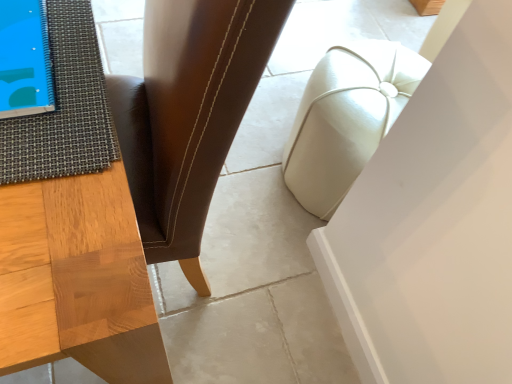
Question: Is brown leather chair at center facing away from textured gray mat at left?

Choices:
 (A) yes
 (B) no

Answer: (A)

Question: Is brown leather chair at center touching textured gray mat at left?

Choices:
 (A) no
 (B) yes

Answer: (A)

Question: Does brown leather chair at center lie in front of textured gray mat at left?

Choices:
 (A) no
 (B) yes

Answer: (B)

Question: From a real-world perspective, is brown leather chair at center positioned under textured gray mat at left based on gravity?

Choices:
 (A) yes
 (B) no

Answer: (A)

Question: Does brown leather chair at center have a lesser height compared to textured gray mat at left?

Choices:
 (A) yes
 (B) no

Answer: (B)

Question: Considering the positions of textured gray mat at left and brown leather chair at center in the image, is textured gray mat at left taller or shorter than brown leather chair at center?

Choices:
 (A) tall
 (B) short

Answer: (B)

Question: In terms of width, does textured gray mat at left look wider or thinner when compared to brown leather chair at center?

Choices:
 (A) wide
 (B) thin

Answer: (B)

Question: Based on their sizes in the image, would you say textured gray mat at left is bigger or smaller than brown leather chair at center?

Choices:
 (A) small
 (B) big

Answer: (A)

Question: From a real-world perspective, is textured gray mat at left positioned above or below brown leather chair at center?

Choices:
 (A) above
 (B) below

Answer: (A)

Question: Considering the positions of point (318, 89) and point (31, 175), is point (318, 89) closer or farther from the camera than point (31, 175)?

Choices:
 (A) farther
 (B) closer

Answer: (A)

Question: From a real-world perspective, is white leather ottoman at center above or below textured gray mat at left?

Choices:
 (A) below
 (B) above

Answer: (A)

Question: From the image's perspective, relative to textured gray mat at left, is white leather ottoman at center above or below?

Choices:
 (A) above
 (B) below

Answer: (B)

Question: Looking at their shapes, would you say white leather ottoman at center is wider or thinner than textured gray mat at left?

Choices:
 (A) wide
 (B) thin

Answer: (B)

Question: Is textured gray mat at left inside the boundaries of white leather ottoman at center, or outside?

Choices:
 (A) inside
 (B) outside

Answer: (B)

Question: Is point (56, 74) closer or farther from the camera than point (305, 188)?

Choices:
 (A) farther
 (B) closer

Answer: (B)